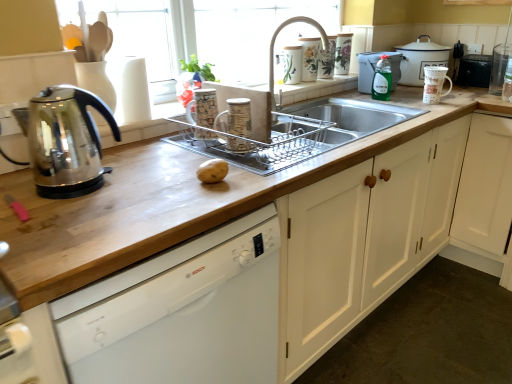
Question: Is brown matte potato at center oriented towards white enamel pot at upper right, which appears as the 3th kitchen appliance when ordered from the bottom?

Choices:
 (A) no
 (B) yes

Answer: (A)

Question: Can you confirm if brown matte potato at center is smaller than white enamel pot at upper right, positioned as the first kitchen appliance in right-to-left order?

Choices:
 (A) yes
 (B) no

Answer: (A)

Question: Does brown matte potato at center appear on the left side of white enamel pot at upper right, the third kitchen appliance positioned from the left?

Choices:
 (A) no
 (B) yes

Answer: (B)

Question: From a real-world perspective, is brown matte potato at center beneath white enamel pot at upper right, the 3th kitchen appliance when ordered from front to back?

Choices:
 (A) yes
 (B) no

Answer: (A)

Question: From a real-world perspective, is brown matte potato at center on top of white enamel pot at upper right, which is the first kitchen appliance in back-to-front order?

Choices:
 (A) yes
 (B) no

Answer: (B)

Question: Is matte ceramic mug at upper center, which is the 6th appliance from right to left, situated inside black plastic trash can at upper right, the 6th appliance viewed from the left, or outside?

Choices:
 (A) inside
 (B) outside

Answer: (B)

Question: From the image's perspective, is matte ceramic mug at upper center, which is the 6th appliance from right to left, above or below black plastic trash can at upper right, the 6th appliance viewed from the left?

Choices:
 (A) above
 (B) below

Answer: (B)

Question: Considering the positions of matte ceramic mug at upper center, which is the 6th appliance from right to left, and black plastic trash can at upper right, the 6th appliance viewed from the left, in the image, is matte ceramic mug at upper center, which is the 6th appliance from right to left, bigger or smaller than black plastic trash can at upper right, the 6th appliance viewed from the left,?

Choices:
 (A) big
 (B) small

Answer: (B)

Question: Would you say matte ceramic mug at upper center, the second appliance in the left-to-right sequence, is to the left or to the right of black plastic trash can at upper right, the 6th appliance viewed from the left, in the picture?

Choices:
 (A) left
 (B) right

Answer: (A)

Question: Looking at their shapes, would you say matte ceramic mug at upper center, the second appliance in the left-to-right sequence, is wider or thinner than transparent glass kettle at left, acting as the 3th kitchen appliance starting from the top?

Choices:
 (A) thin
 (B) wide

Answer: (A)

Question: Relative to transparent glass kettle at left, the first kitchen appliance in the front-to-back sequence, is matte ceramic mug at upper center, the second appliance in the left-to-right sequence, in front or behind?

Choices:
 (A) front
 (B) behind

Answer: (B)

Question: Do you think matte ceramic mug at upper center, which is the 6th appliance from right to left, is within transparent glass kettle at left, the third kitchen appliance when ordered from right to left, or outside of it?

Choices:
 (A) outside
 (B) inside

Answer: (A)

Question: Is matte ceramic mug at upper center, the second appliance in the left-to-right sequence, bigger or smaller than transparent glass kettle at left, acting as the 3th kitchen appliance starting from the top?

Choices:
 (A) big
 (B) small

Answer: (B)

Question: From a real-world perspective, is white glossy dishwasher at center physically located above or below clear glass at upper right, the 7th appliance in the left-to-right sequence?

Choices:
 (A) below
 (B) above

Answer: (A)

Question: In the image, is white glossy dishwasher at center positioned in front of or behind clear glass at upper right, the 1th appliance positioned from the right?

Choices:
 (A) behind
 (B) front

Answer: (B)